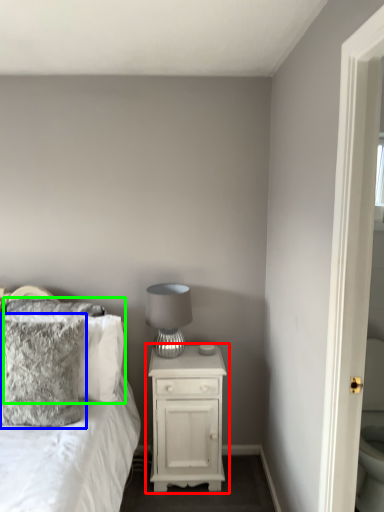
Question: Which object is the closest to the nightstand (highlighted by a red box)? Choose among these: pillow (highlighted by a blue box) or pillow (highlighted by a green box).

Choices:
 (A) pillow
 (B) pillow

Answer: (B)